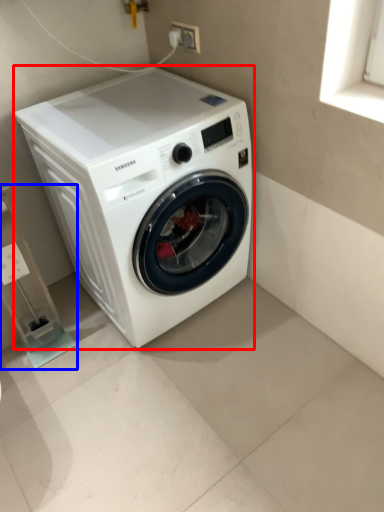
Question: Which object is further to the camera taking this photo, washing machine (highlighted by a red box) or shelf (highlighted by a blue box)?

Choices:
 (A) washing machine
 (B) shelf

Answer: (B)